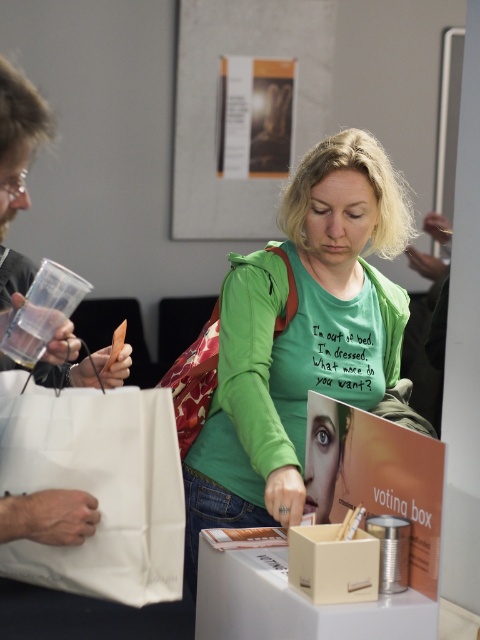
You are standing at the center of the image and want to pick up the white paper bag at left. In which direction should you move to reach it?

The white paper bag at left is located at point (16, 170), so you should move to the left to reach it.